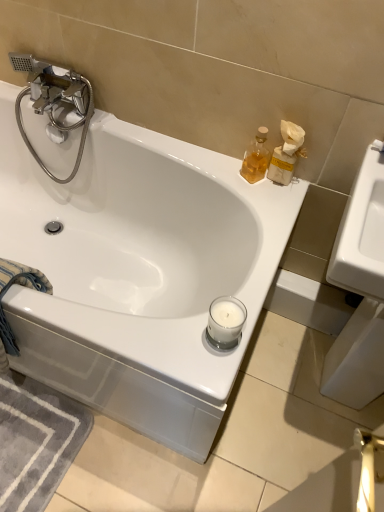
Question: Is translucent glass soap dispenser at upper right wider or thinner than chrome/metallic faucet at upper left?

Choices:
 (A) thin
 (B) wide

Answer: (A)

Question: In the image, is translucent glass soap dispenser at upper right on the left side or the right side of chrome/metallic faucet at upper left?

Choices:
 (A) right
 (B) left

Answer: (A)

Question: Based on their relative distances, which object is farther from the chrome/metallic faucet at upper left?

Choices:
 (A) blue cotton towel at lower left
 (B) translucent glass soap dispenser at upper right
 (C) white glossy bathtub at upper center

Answer: (B)

Question: Estimate the real-world distances between objects in this image. Which object is farther from the blue cotton towel at lower left?

Choices:
 (A) chrome/metallic faucet at upper left
 (B) white glossy bathtub at upper center
 (C) translucent glass soap dispenser at upper right

Answer: (C)